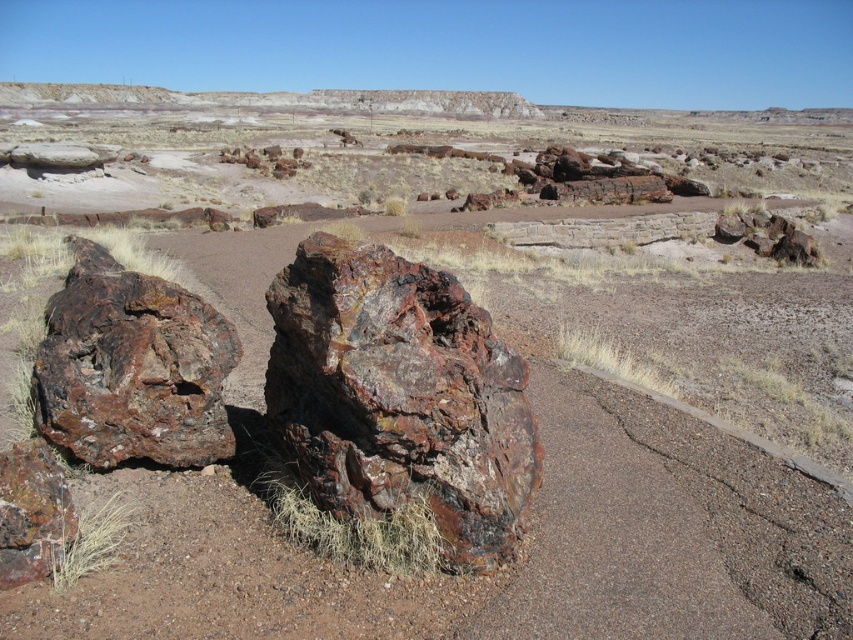
Between rusty stone boulder at center and rusty wood log at left, which one has more height?

rusty stone boulder at center is taller.

Can you confirm if rusty stone boulder at center is positioned above rusty wood log at left?

Incorrect, rusty stone boulder at center is not positioned above rusty wood log at left.

What do you see at coordinates (399, 396) in the screenshot?
I see `rusty stone boulder at center` at bounding box center [399, 396].

Image resolution: width=853 pixels, height=640 pixels. I want to click on rusty stone boulder at center, so click(x=399, y=396).